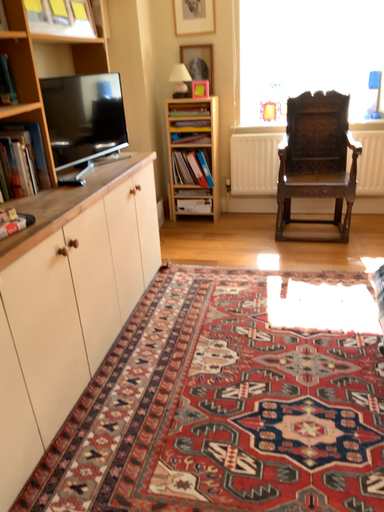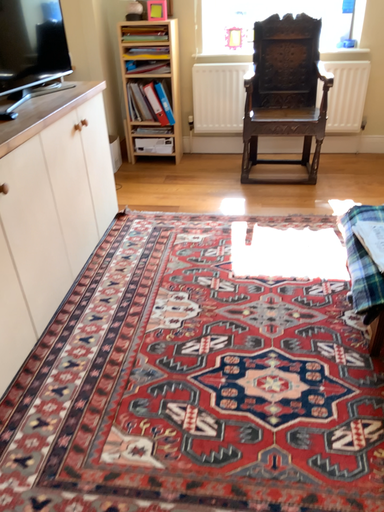
Question: How did the camera likely rotate when shooting the video?

Choices:
 (A) rotated upward
 (B) rotated downward

Answer: (B)